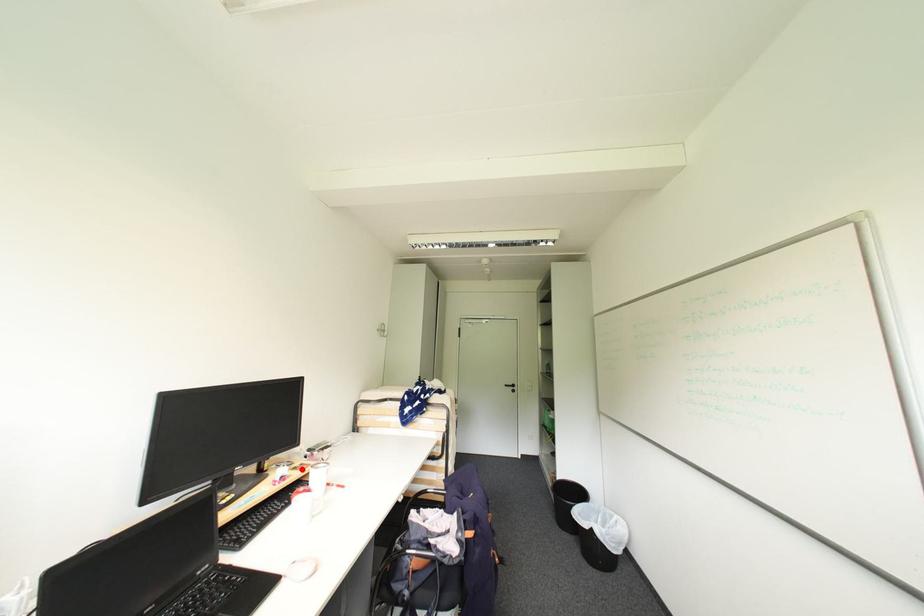
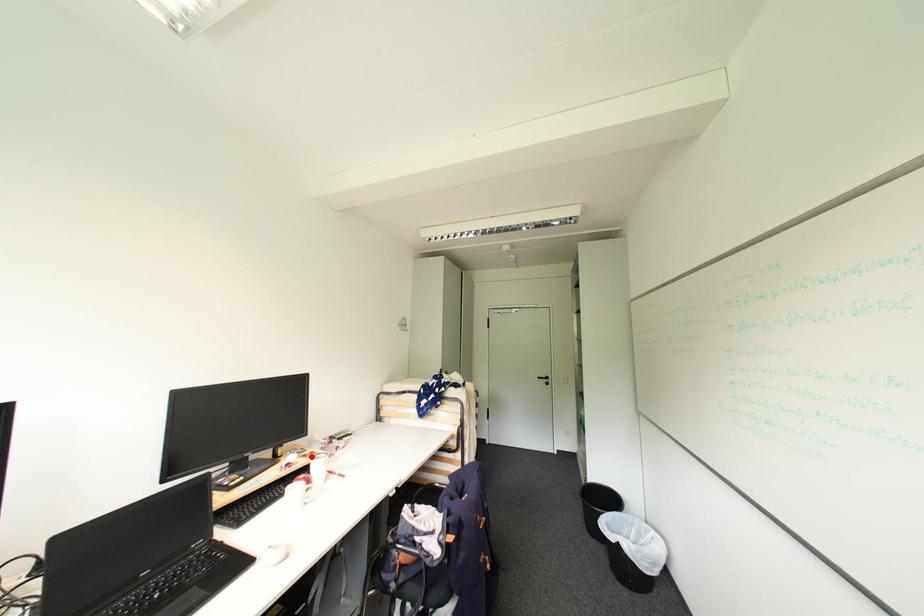
I am providing you with two images of the same scene from different viewpoints. A red point is marked on the first image and another point is marked on the second image. Are the points marked in image1 and image2 representing the same 3D position?

Yes